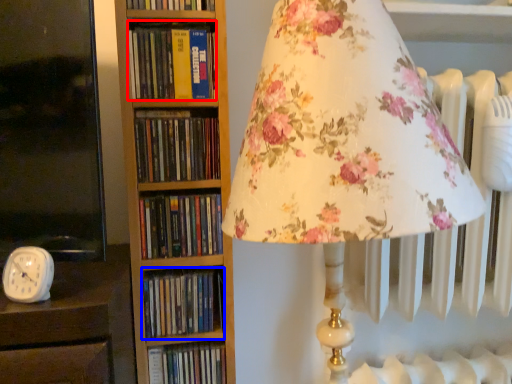
Question: Which object is further to the camera taking this photo, book (highlighted by a red box) or book (highlighted by a blue box)?

Choices:
 (A) book
 (B) book

Answer: (B)